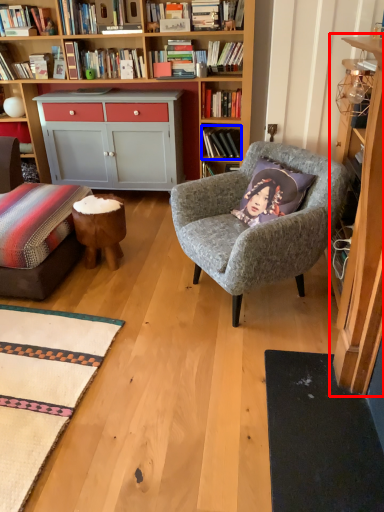
Question: Which object is closer to the camera taking this photo, cabinet (highlighted by a red box) or book (highlighted by a blue box)?

Choices:
 (A) cabinet
 (B) book

Answer: (A)